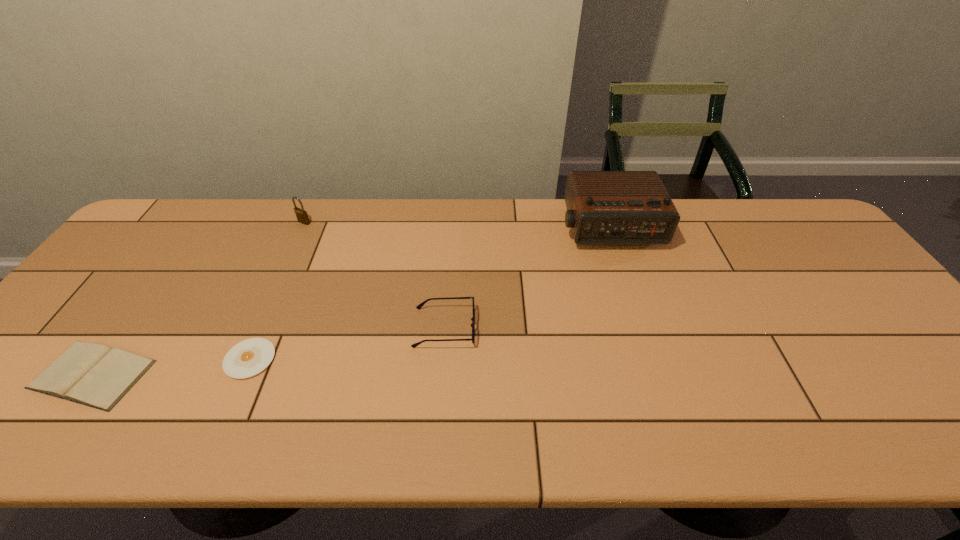
Identify the location of empty space between the tallest object and the third shortest object. (527, 278).

This screenshot has width=960, height=540. In order to click on vacant area that lies between the rightmost object and the third shortest object in this screenshot , I will do `click(527, 278)`.

I want to click on object that is the third closest to the spectacles, so (302, 216).

Identify which object is the third nearest to the tallest object. Please provide its 2D coordinates. Your answer should be formatted as a tuple, i.e. [(x, y)], where the tuple contains the x and y coordinates of a point satisfying the conditions above.

[(249, 357)]

Locate an element on the screen. The width and height of the screenshot is (960, 540). free location that satisfies the following two spatial constraints: 1. on the front-facing side of the second object from right to left; 2. on the front side of the leftmost object is located at coordinates [441, 374].

Where is `free location that satisfies the following two spatial constraints: 1. on the front-facing side of the spectacles; 2. on the front side of the egg yolk`? free location that satisfies the following two spatial constraints: 1. on the front-facing side of the spectacles; 2. on the front side of the egg yolk is located at coordinates (443, 359).

The width and height of the screenshot is (960, 540). Identify the location of vacant area in the image that satisfies the following two spatial constraints: 1. on the front-facing side of the spectacles; 2. on the front side of the leftmost object. (441, 374).